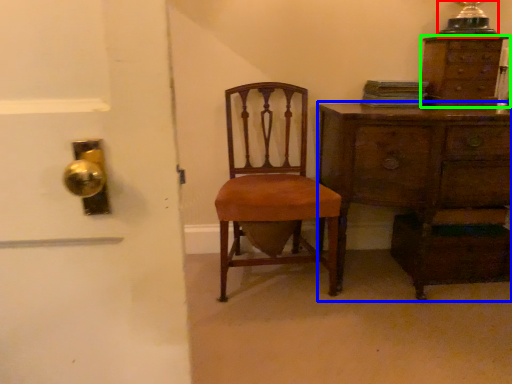
Question: Which is farther away from table lamp (highlighted by a red box)? chest of drawers (highlighted by a blue box) or chest of drawers (highlighted by a green box)?

Choices:
 (A) chest of drawers
 (B) chest of drawers

Answer: (A)